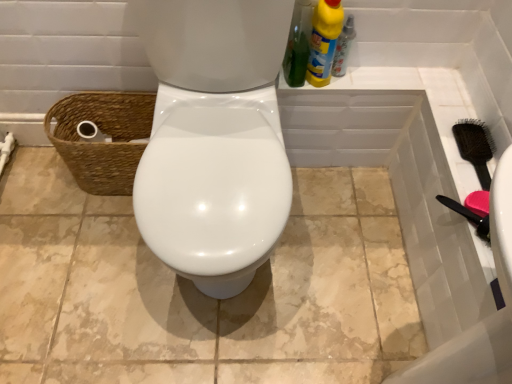
You are a GUI agent. You are given a task and a screenshot of the screen. Output one action in this format:
    pyautogui.click(x=<x>, y=<y>)
    Task: Click on the space that is in front of brown woven basket at left
    The height and width of the screenshot is (384, 512).
    Given the screenshot: What is the action you would take?
    pyautogui.click(x=90, y=226)